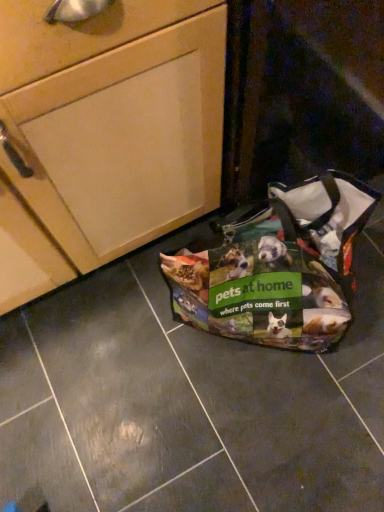
Image resolution: width=384 pixels, height=512 pixels. What are the coordinates of `free spot in front of printed fabric pet carrier at lower right` in the screenshot? It's located at (297, 440).